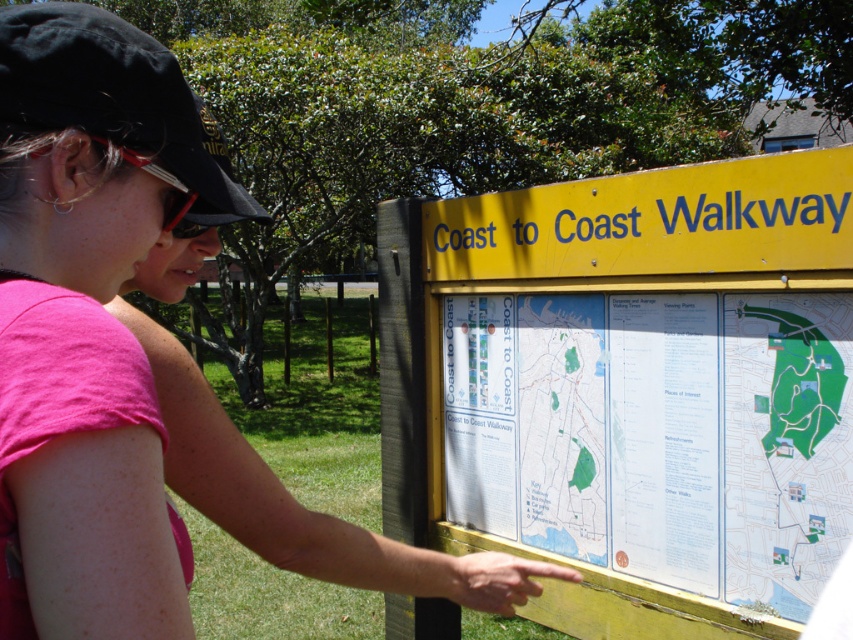
Which is in front, point (169, 144) or point (184, 204)?

Point (169, 144) is in front.

Which is behind, point (190, 260) or point (189, 192)?

The point (190, 260) is behind.

Does point (239, 216) come farther from viewer compared to point (173, 225)?

Yes, point (239, 216) is behind point (173, 225).

At what (x,y) coordinates should I click in order to perform the action: click on pink fabric shirt at center. Please return your answer as a coordinate pair (x, y). Image resolution: width=853 pixels, height=640 pixels. Looking at the image, I should click on (299, 502).

Is green paper map at center to the right of pink fabric shirt at center from the viewer's perspective?

Indeed, green paper map at center is positioned on the right side of pink fabric shirt at center.

Does green paper map at center have a larger size compared to pink fabric shirt at center?

Actually, green paper map at center might be smaller than pink fabric shirt at center.

Locate an element on the screen. green paper map at center is located at coordinates (659, 435).

Where is `green paper map at center`? The image size is (853, 640). green paper map at center is located at coordinates (659, 435).

Between green paper map at center and metallic red sunglasses at upper left, which one has less height?

With less height is metallic red sunglasses at upper left.

Is point (613, 512) positioned behind point (152, 168)?

Yes, point (613, 512) is farther from viewer.

The image size is (853, 640). I want to click on green paper map at center, so click(659, 435).